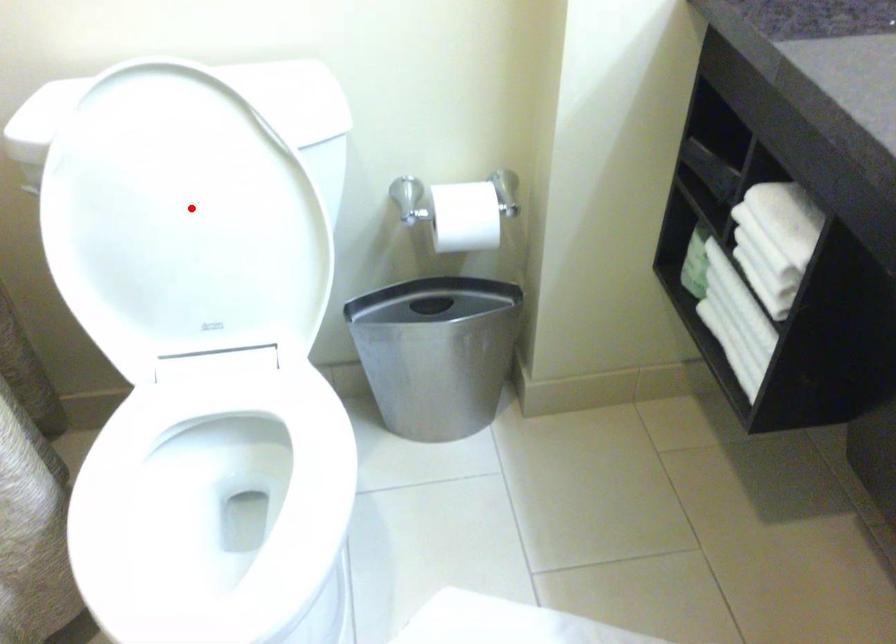
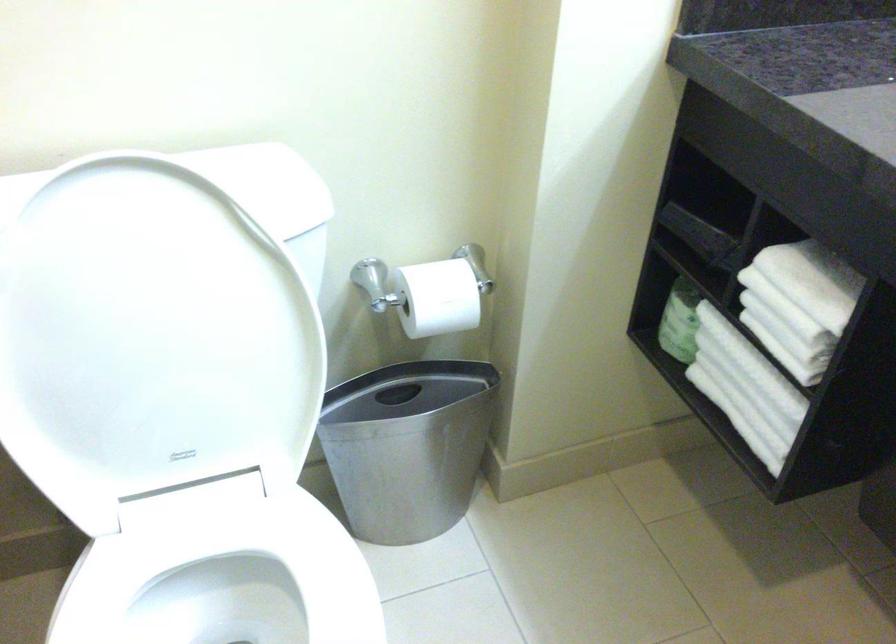
Where in the second image is the point corresponding to the highlighted location from the first image?

(159, 323)